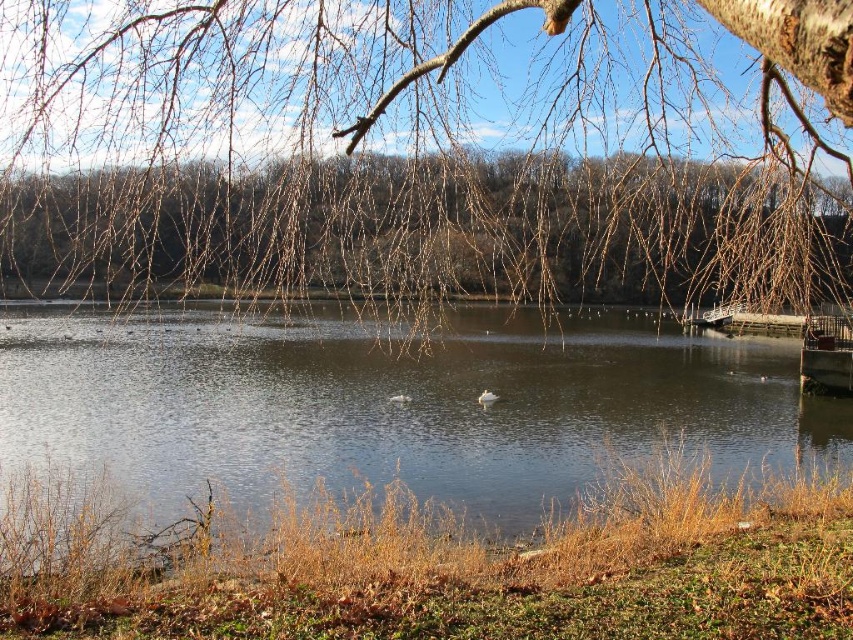
Question: Which point is farther to the camera?

Choices:
 (A) (312, 438)
 (B) (816, 330)
 (C) (161, 138)

Answer: (B)

Question: Does clear water at center have a greater width compared to metallic red boat at lower right?

Choices:
 (A) yes
 (B) no

Answer: (A)

Question: Which point appears farthest from the camera in this image?

Choices:
 (A) (59, 67)
 (B) (833, 355)
 (C) (579, 328)

Answer: (C)

Question: Does clear water at center appear over metallic red boat at lower right?

Choices:
 (A) yes
 (B) no

Answer: (A)

Question: Which of the following is the closest to the observer?

Choices:
 (A) (102, 445)
 (B) (830, 337)

Answer: (A)

Question: Does brown/dry branches at upper center appear on the right side of metallic red boat at lower right?

Choices:
 (A) yes
 (B) no

Answer: (B)